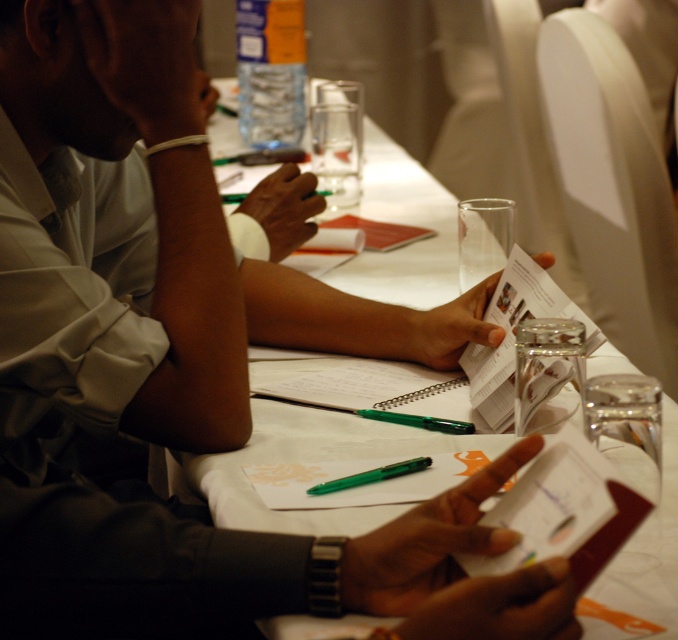
Question: Considering the relative positions of white paper at center and green plastic pen at center in the image provided, where is white paper at center located with respect to green plastic pen at center?

Choices:
 (A) right
 (B) left

Answer: (A)

Question: Which object is positioned closest to the matte paper notepad at center?

Choices:
 (A) green plastic pen at center
 (B) spiral notebook at center

Answer: (B)

Question: Which of the following is the closest to the observer?

Choices:
 (A) green plastic pen at center
 (B) white paper at center
 (C) spiral notebook at center
 (D) matte paper notepad at center

Answer: (A)

Question: Does white paper at center have a smaller size compared to spiral notebook at center?

Choices:
 (A) no
 (B) yes

Answer: (A)

Question: Considering the relative positions of green plastic pen at center and spiral notebook at center in the image provided, where is green plastic pen at center located with respect to spiral notebook at center?

Choices:
 (A) above
 (B) below

Answer: (B)

Question: Among these points, which one is farthest from the camera?

Choices:
 (A) (399, 448)
 (B) (464, 380)
 (C) (433, 232)

Answer: (C)